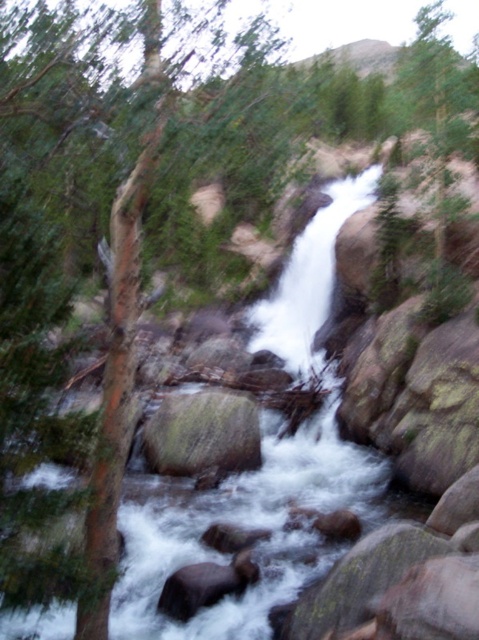
Question: Among these points, which one is nearest to the camera?

Choices:
 (A) pos(192,609)
 (B) pos(155,456)

Answer: (A)

Question: Can you confirm if green mossy rock at center is wider than smooth brown rock at center?

Choices:
 (A) yes
 (B) no

Answer: (A)

Question: In this image, where is green mossy rock at center located relative to smooth brown rock at center?

Choices:
 (A) above
 (B) below

Answer: (A)

Question: Considering the relative positions of green mossy rock at center and smooth brown rock at center in the image provided, where is green mossy rock at center located with respect to smooth brown rock at center?

Choices:
 (A) right
 (B) left

Answer: (B)

Question: Which object is closer to the camera taking this photo?

Choices:
 (A) smooth brown rock at center
 (B) green mossy rock at center

Answer: (A)